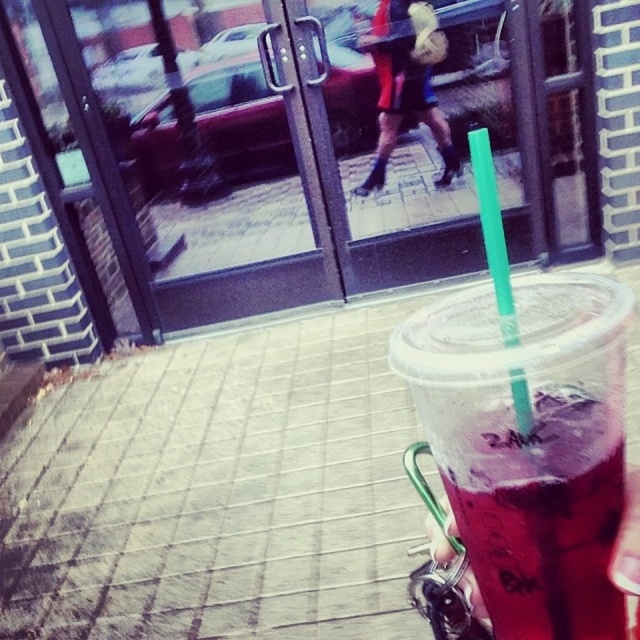
In the scene shown: You are holding the purple translucent cup at lower right and want to drink from the green plastic straw at center. Can you reach the straw without moving the cup?

The green plastic straw at center is located above the purple translucent cup at lower right, so yes, you can reach the straw without moving the cup.

You are holding a takeaway cup with a green plastic straw at center. If you want to drink without spilling, should you tilt the cup more or less than usual?

The green plastic straw at center is 34.39 centimeters away from viewer, meaning it is positioned far enough that tilting the cup slightly less than usual would help prevent spilling.